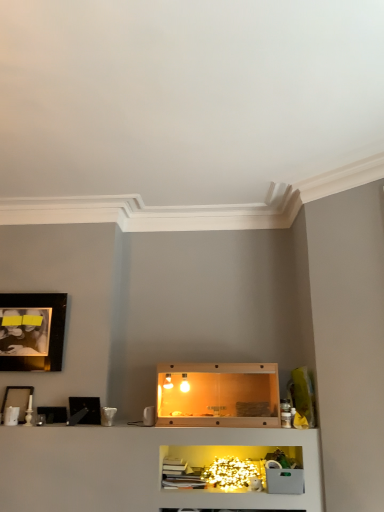
Find the location of a particular element. The width and height of the screenshot is (384, 512). black glossy photo frame at upper left, marked as the 3th picture frame in a bottom-to-top arrangement is located at coordinates (34, 332).

Is translucent glass shelf at center in front of or behind matte black picture frame at upper left, positioned as the first picture frame in left-to-right order, in the image?

In the image, translucent glass shelf at center appears in front of matte black picture frame at upper left, positioned as the first picture frame in left-to-right order.

Considering the sizes of translucent glass shelf at center and matte black picture frame at upper left, which is counted as the second picture frame, starting from the top, in the image, is translucent glass shelf at center wider or thinner than matte black picture frame at upper left, which is counted as the second picture frame, starting from the top,?

In the image, translucent glass shelf at center appears to be wider than matte black picture frame at upper left, which is counted as the second picture frame, starting from the top.

Is translucent glass shelf at center taller than matte black picture frame at upper left, which is counted as the second picture frame, starting from the top?

Correct, translucent glass shelf at center is much taller as matte black picture frame at upper left, which is counted as the second picture frame, starting from the top.

Are black glossy picture frame at left, acting as the third picture frame starting from the top, and matte black picture frame at upper left, which is counted as the second picture frame, starting from the top, beside each other?

No, black glossy picture frame at left, acting as the third picture frame starting from the top, is not next to matte black picture frame at upper left, which is counted as the second picture frame, starting from the top.

Considering the relative positions of black glossy picture frame at left, acting as the third picture frame starting from the top, and matte black picture frame at upper left, placed as the second picture frame when sorted from bottom to top, in the image provided, is black glossy picture frame at left, acting as the third picture frame starting from the top, to the left of matte black picture frame at upper left, placed as the second picture frame when sorted from bottom to top, from the viewer's perspective?

Incorrect, black glossy picture frame at left, acting as the third picture frame starting from the top, is not on the left side of matte black picture frame at upper left, placed as the second picture frame when sorted from bottom to top.

How far apart are black glossy picture frame at left, the first picture frame from the bottom, and matte black picture frame at upper left, positioned as the first picture frame in left-to-right order?

black glossy picture frame at left, the first picture frame from the bottom, and matte black picture frame at upper left, positioned as the first picture frame in left-to-right order, are 16.10 inches apart.

Is matte black picture frame at upper left, which is counted as the second picture frame, starting from the top, inside black glossy picture frame at left, arranged as the first picture frame when viewed from the right?

No, matte black picture frame at upper left, which is counted as the second picture frame, starting from the top, is not inside black glossy picture frame at left, arranged as the first picture frame when viewed from the right.

Considering the positions of point (48, 366) and point (177, 398), is point (48, 366) closer or farther from the camera than point (177, 398)?

Point (48, 366) appears to be farther away from the viewer than point (177, 398).

Which object is thinner, black glossy photo frame at upper left, marked as the second picture frame in a left-to-right arrangement, or translucent glass shelf at center?

black glossy photo frame at upper left, marked as the second picture frame in a left-to-right arrangement, is thinner.

Are black glossy photo frame at upper left, marked as the second picture frame in a left-to-right arrangement, and translucent glass shelf at center located far from each other?

Indeed, black glossy photo frame at upper left, marked as the second picture frame in a left-to-right arrangement, is not near translucent glass shelf at center.

Does matte black picture frame at upper left, which ranks as the 3th picture frame in right-to-left order, have a lesser height compared to black glossy photo frame at upper left, the first picture frame from the top?

Indeed, matte black picture frame at upper left, which ranks as the 3th picture frame in right-to-left order, has a lesser height compared to black glossy photo frame at upper left, the first picture frame from the top.

From the image's perspective, is matte black picture frame at upper left, placed as the second picture frame when sorted from bottom to top, under black glossy photo frame at upper left, the first picture frame from the top?

Yes, from the image's perspective, matte black picture frame at upper left, placed as the second picture frame when sorted from bottom to top, is beneath black glossy photo frame at upper left, the first picture frame from the top.

Is matte black picture frame at upper left, positioned as the first picture frame in left-to-right order, facing away from black glossy photo frame at upper left, marked as the second picture frame in a left-to-right arrangement?

matte black picture frame at upper left, positioned as the first picture frame in left-to-right order, does not have its back to black glossy photo frame at upper left, marked as the second picture frame in a left-to-right arrangement.

Is matte black picture frame at upper left, which is counted as the second picture frame, starting from the top, not close to black glossy photo frame at upper left, marked as the 3th picture frame in a bottom-to-top arrangement?

Actually, matte black picture frame at upper left, which is counted as the second picture frame, starting from the top, and black glossy photo frame at upper left, marked as the 3th picture frame in a bottom-to-top arrangement, are a little close together.

How many degrees apart are the facing directions of matte black picture frame at upper left, which is counted as the second picture frame, starting from the top, and translucent glass shelf at center?

The angular difference between matte black picture frame at upper left, which is counted as the second picture frame, starting from the top, and translucent glass shelf at center is 179 degrees.

This screenshot has height=512, width=384. Find the location of `shelf in front of the matte black picture frame at upper left, which is counted as the second picture frame, starting from the top`. shelf in front of the matte black picture frame at upper left, which is counted as the second picture frame, starting from the top is located at coordinates (218, 395).

Which object is closer to the camera taking this photo, matte black picture frame at upper left, placed as the second picture frame when sorted from bottom to top, or translucent glass shelf at center?

translucent glass shelf at center.

Could you measure the distance between translucent glass shelf at center and black glossy picture frame at left, arranged as the first picture frame when viewed from the right?

translucent glass shelf at center and black glossy picture frame at left, arranged as the first picture frame when viewed from the right, are 32.60 inches apart from each other.

Looking at their sizes, would you say translucent glass shelf at center is wider or thinner than black glossy picture frame at left, acting as the third picture frame starting from the top?

Considering their sizes, translucent glass shelf at center looks broader than black glossy picture frame at left, acting as the third picture frame starting from the top.

In the scene shown: Is translucent glass shelf at center inside or outside of black glossy picture frame at left, arranged as the first picture frame when viewed from the right?

translucent glass shelf at center is not inside black glossy picture frame at left, arranged as the first picture frame when viewed from the right, it's outside.

Looking at the image, does matte black picture frame at upper left, positioned as the first picture frame in left-to-right order, seem bigger or smaller compared to black glossy picture frame at left, the first picture frame from the bottom?

matte black picture frame at upper left, positioned as the first picture frame in left-to-right order, is smaller than black glossy picture frame at left, the first picture frame from the bottom.

Would you say matte black picture frame at upper left, which ranks as the 3th picture frame in right-to-left order, is a long distance from black glossy picture frame at left, arranged as the first picture frame when viewed from the right?

No, there isn't a large distance between matte black picture frame at upper left, which ranks as the 3th picture frame in right-to-left order, and black glossy picture frame at left, arranged as the first picture frame when viewed from the right.

Between point (20, 398) and point (83, 398), which one is positioned behind?

Point (83, 398)

Which picture frame is the 2nd one when counting from the right side of the matte black picture frame at upper left, which ranks as the 3th picture frame in right-to-left order? Please provide its 2D coordinates.

[(86, 407)]

Where is `the 2nd picture frame behind when counting from the translucent glass shelf at center`? the 2nd picture frame behind when counting from the translucent glass shelf at center is located at coordinates (17, 400).

Where is `the 2nd picture frame to the left of the black glossy picture frame at left, acting as the third picture frame starting from the top, counting from the anchor's position`? Image resolution: width=384 pixels, height=512 pixels. the 2nd picture frame to the left of the black glossy picture frame at left, acting as the third picture frame starting from the top, counting from the anchor's position is located at coordinates (17, 400).

Looking at the image, which one is located closer to black glossy picture frame at left, the first picture frame from the bottom, translucent glass shelf at center or black glossy photo frame at upper left, which ranks as the second picture frame in right-to-left order?

The object closer to black glossy picture frame at left, the first picture frame from the bottom, is black glossy photo frame at upper left, which ranks as the second picture frame in right-to-left order.

Based on their spatial positions, is matte black picture frame at upper left, which ranks as the 3th picture frame in right-to-left order, or translucent glass shelf at center further from black glossy picture frame at left, arranged as the first picture frame when viewed from the right?

translucent glass shelf at center is positioned further to the anchor black glossy picture frame at left, arranged as the first picture frame when viewed from the right.

Considering their positions, is matte black picture frame at upper left, which is counted as the second picture frame, starting from the top, positioned closer to black glossy photo frame at upper left, the first picture frame from the top, than black glossy picture frame at left, arranged as the first picture frame when viewed from the right?

The object closer to black glossy photo frame at upper left, the first picture frame from the top, is matte black picture frame at upper left, which is counted as the second picture frame, starting from the top.

When comparing their distances from translucent glass shelf at center, does matte black picture frame at upper left, which is counted as the second picture frame, starting from the top, or black glossy picture frame at left, which is the 3th picture frame in left-to-right order, seem closer?

The object closer to translucent glass shelf at center is black glossy picture frame at left, which is the 3th picture frame in left-to-right order.

When comparing their distances from black glossy photo frame at upper left, the first picture frame from the top, does translucent glass shelf at center or matte black picture frame at upper left, positioned as the first picture frame in left-to-right order, seem closer?

Based on the image, matte black picture frame at upper left, positioned as the first picture frame in left-to-right order, appears to be nearer to black glossy photo frame at upper left, the first picture frame from the top.

From the image, which object appears to be nearer to translucent glass shelf at center, black glossy picture frame at left, arranged as the first picture frame when viewed from the right, or matte black picture frame at upper left, placed as the second picture frame when sorted from bottom to top?

black glossy picture frame at left, arranged as the first picture frame when viewed from the right, is positioned closer to the anchor translucent glass shelf at center.

From the image, which object appears to be nearer to black glossy photo frame at upper left, marked as the 3th picture frame in a bottom-to-top arrangement, matte black picture frame at upper left, which ranks as the 3th picture frame in right-to-left order, or translucent glass shelf at center?

matte black picture frame at upper left, which ranks as the 3th picture frame in right-to-left order.

Estimate the real-world distances between objects in this image. Which object is closer to black glossy picture frame at left, the first picture frame from the bottom, matte black picture frame at upper left, which is counted as the second picture frame, starting from the top, or black glossy photo frame at upper left, marked as the second picture frame in a left-to-right arrangement?

matte black picture frame at upper left, which is counted as the second picture frame, starting from the top.

This screenshot has height=512, width=384. I want to click on picture frame between black glossy photo frame at upper left, the first picture frame from the top, and black glossy picture frame at left, acting as the third picture frame starting from the top, in the vertical direction, so click(x=17, y=400).

At what (x,y) coordinates should I click in order to perform the action: click on picture frame between black glossy photo frame at upper left, marked as the second picture frame in a left-to-right arrangement, and translucent glass shelf at center, in the horizontal direction. Please return your answer as a coordinate pair (x, y). The image size is (384, 512). Looking at the image, I should click on (86, 407).